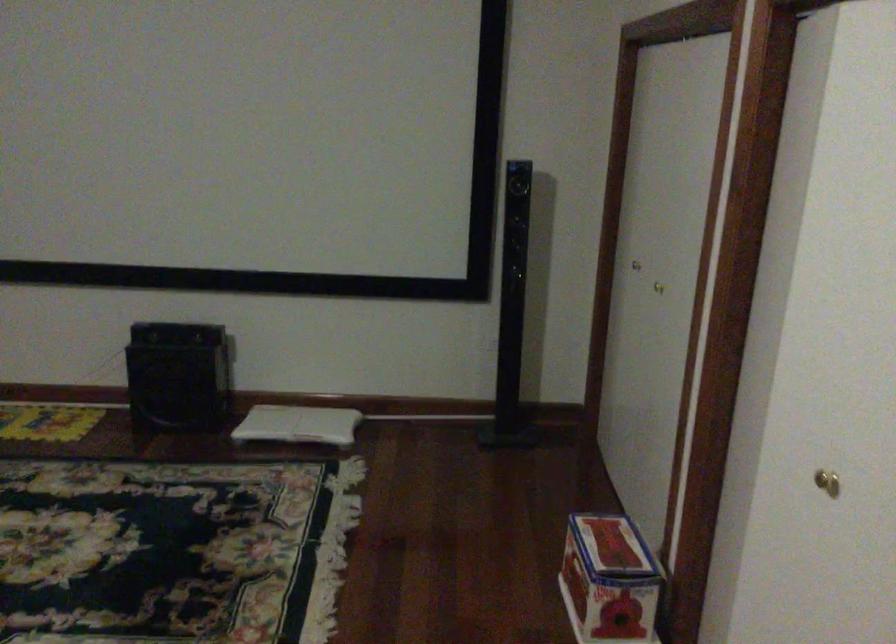
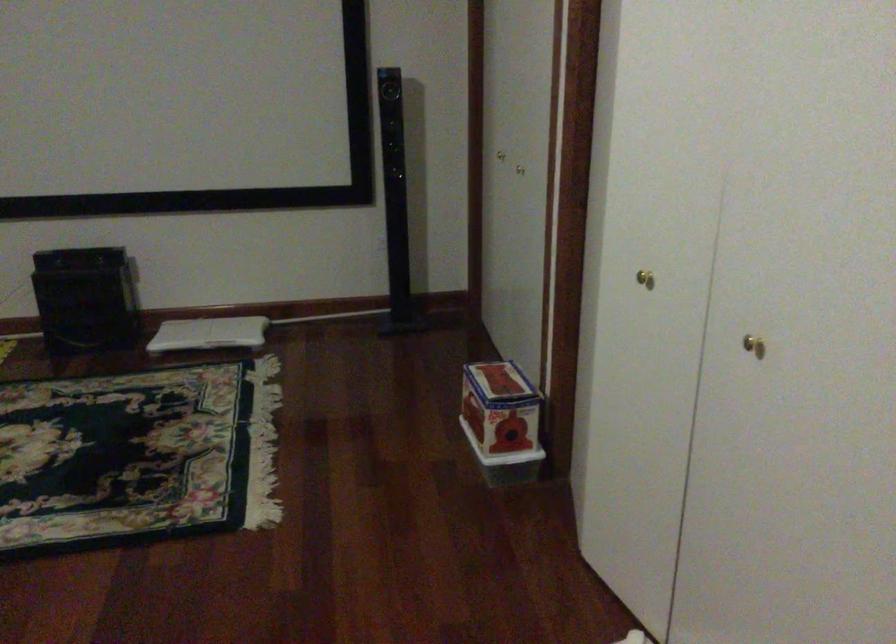
The point at (299, 429) is marked in the first image. Where is the corresponding point in the second image?

(209, 333)